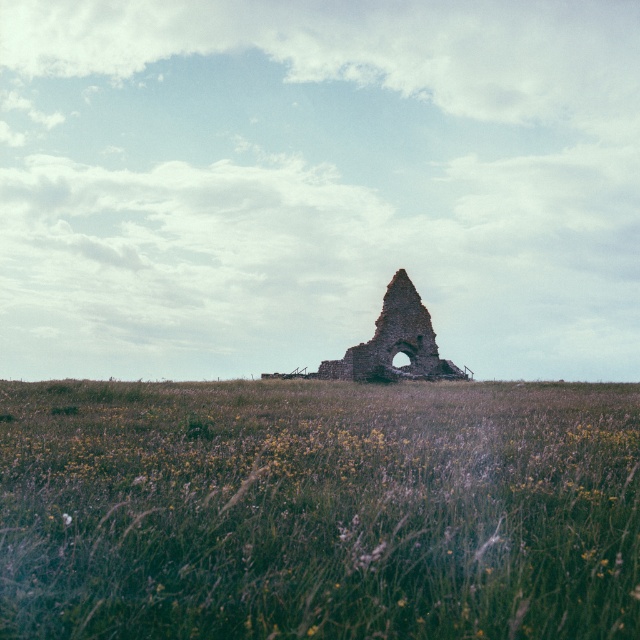
Can you confirm if green grassy field at center is positioned above brown stone ruins at center?

Incorrect, green grassy field at center is not positioned above brown stone ruins at center.

Can you confirm if green grassy field at center is taller than brown stone ruins at center?

In fact, green grassy field at center may be shorter than brown stone ruins at center.

Where is `green grassy field at center`? The width and height of the screenshot is (640, 640). green grassy field at center is located at coordinates point(317,509).

Locate an element on the screen. green grassy field at center is located at coordinates pyautogui.click(x=317, y=509).